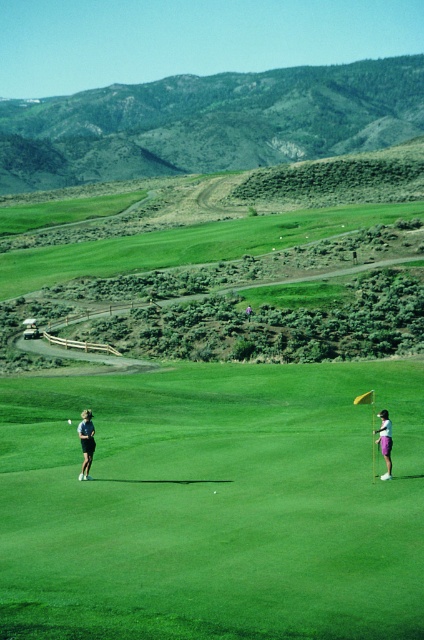
From the picture: You are a golfer trying to determine the best path for your ball to reach the hole. Considering the green grassy golf course at center and the dark gray pants at left, which area is wider?

The green grassy golf course at center is wider than the dark gray pants at left.

In the scene shown: Based on the provided scene, where is the green grassy golf course at center located in terms of coordinates?

The green grassy golf course at center is located at coordinates point (212,506).